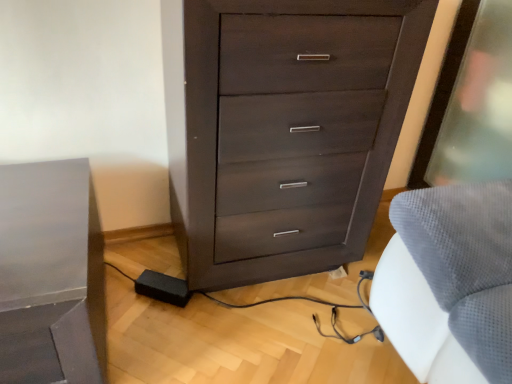
Find the location of a particular element. This screenshot has width=512, height=384. dark wood chest of drawers at center is located at coordinates click(x=289, y=131).

Image resolution: width=512 pixels, height=384 pixels. What do you see at coordinates (289, 131) in the screenshot?
I see `dark wood chest of drawers at center` at bounding box center [289, 131].

Image resolution: width=512 pixels, height=384 pixels. Identify the location of dark wood chest of drawers at center. (289, 131).